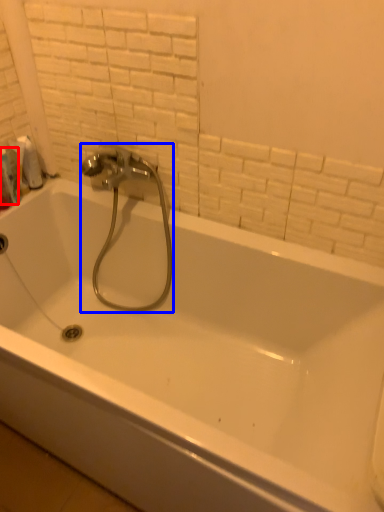
Question: Which of the following is the closest to the observer, toiletry (highlighted by a red box) or plumbing fixture (highlighted by a blue box)?

Choices:
 (A) toiletry
 (B) plumbing fixture

Answer: (B)